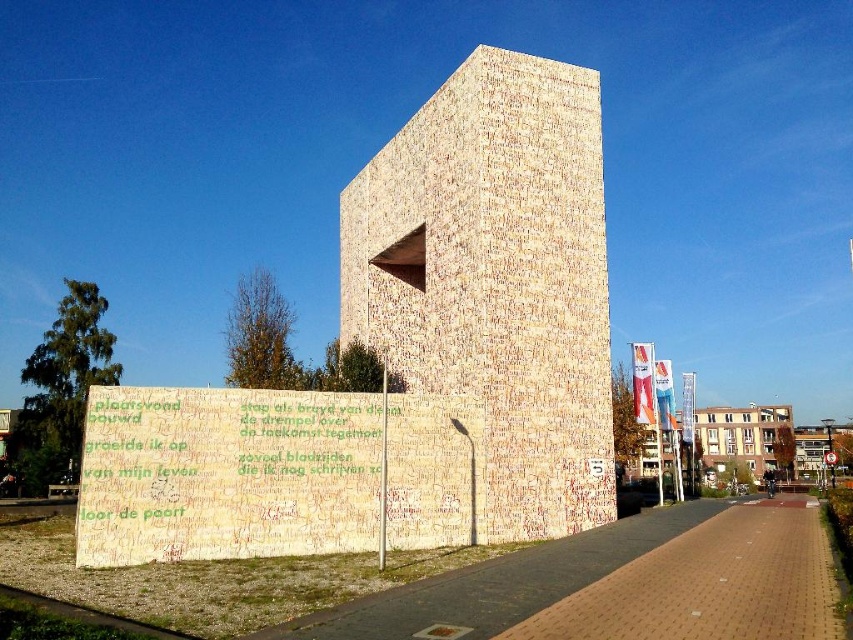
You are an architect visiting the site and need to place a 10m long temporary structure between the beige textured wall at center and the white brick building at center. Given their widths, can you fit the temporary structure between them without overlapping either?

The beige textured wall at center is narrower than the white brick building at center. However, the question of fitting a 10m long temporary structure between them depends on the distance between the two objects, not their widths. Since the width information alone does not provide the spacing between them, it is impossible to determine if the 10m structure would fit without additional measurements.